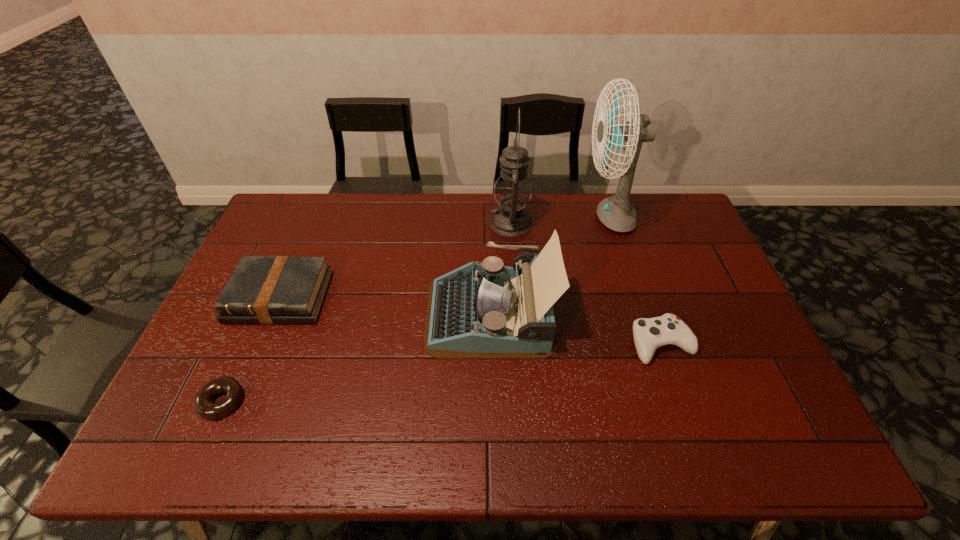
Identify the location of fan. (617, 213).

Locate an element on the screen. The height and width of the screenshot is (540, 960). oil lamp is located at coordinates (512, 191).

Where is `the third tallest object`? the third tallest object is located at coordinates (483, 310).

Find the location of a particular element. This screenshot has width=960, height=540. hardback book is located at coordinates (262, 289).

This screenshot has height=540, width=960. What are the coordinates of `control` in the screenshot? It's located at (649, 334).

Locate an element on the screen. the shortest object is located at coordinates (203, 404).

At what (x,y) coordinates should I click in order to perform the action: click on doughnut. Please return your answer as a coordinate pair (x, y). The width and height of the screenshot is (960, 540). Looking at the image, I should click on (203, 404).

This screenshot has height=540, width=960. I want to click on free space located 0.300m on the front-facing side of the fan, so click(497, 217).

Image resolution: width=960 pixels, height=540 pixels. What are the coordinates of `vacant space located on the front-facing side of the fan` in the screenshot? It's located at (526, 217).

Locate an element on the screen. This screenshot has height=540, width=960. free space located 0.260m on the front-facing side of the fan is located at coordinates (509, 217).